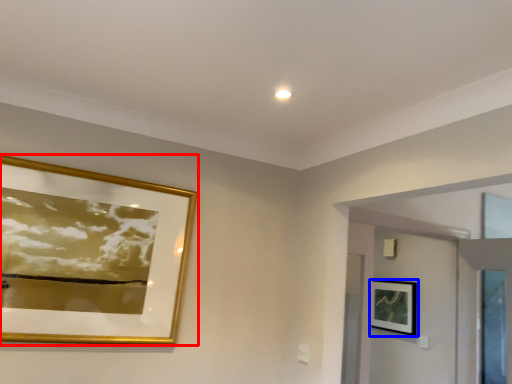
Question: Among these objects, which one is farthest to the camera, picture frame (highlighted by a red box) or picture frame (highlighted by a blue box)?

Choices:
 (A) picture frame
 (B) picture frame

Answer: (B)